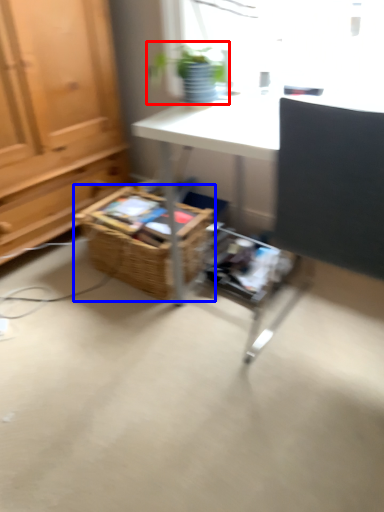
Question: Which object appears closest to the camera in this image, houseplant (highlighted by a red box) or basket (highlighted by a blue box)?

Choices:
 (A) houseplant
 (B) basket

Answer: (A)